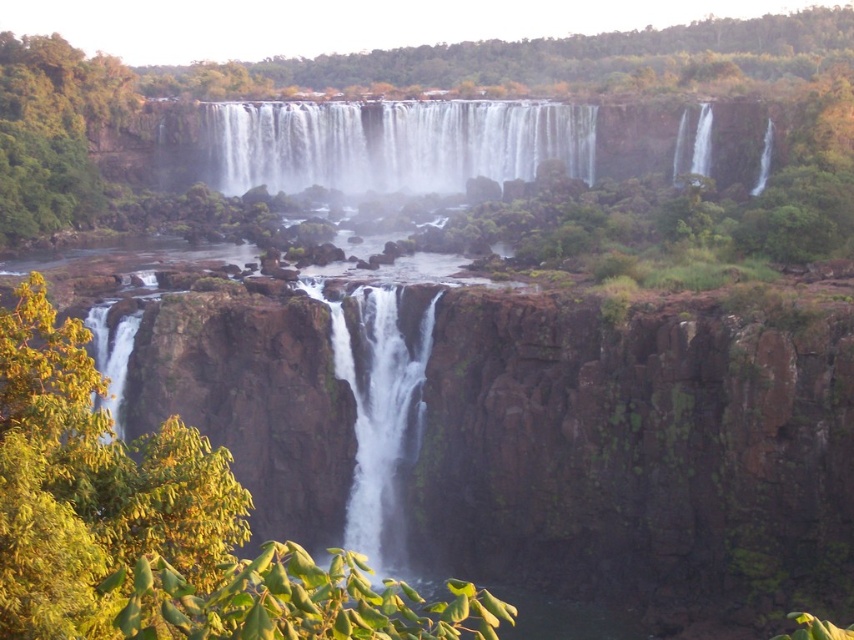
Question: Does white frothy water at center appear on the left side of white smooth waterfall at center?

Choices:
 (A) yes
 (B) no

Answer: (B)

Question: Which object is closer to the camera taking this photo?

Choices:
 (A) white smooth waterfall at center
 (B) white frothy water at center

Answer: (A)

Question: Can you confirm if white frothy water at center is positioned above white smooth waterfall at center?

Choices:
 (A) yes
 (B) no

Answer: (A)

Question: Can you confirm if white frothy water at center is positioned to the right of white smooth waterfall at center?

Choices:
 (A) yes
 (B) no

Answer: (A)

Question: Which point is farther to the camera?

Choices:
 (A) (346, 344)
 (B) (410, 113)

Answer: (B)

Question: Which point is farther from the camera taking this photo?

Choices:
 (A) (414, 388)
 (B) (464, 108)

Answer: (B)